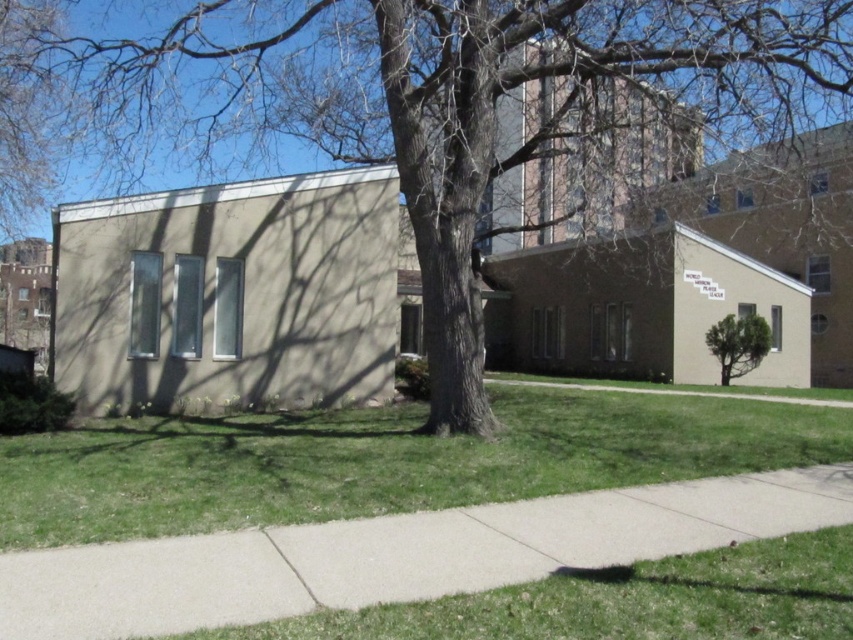
Can you confirm if brown textured tree at center is thinner than green grass at lower left?

Incorrect, brown textured tree at center's width is not less than green grass at lower left's.

In the scene shown: Between brown textured tree at center and green grass at lower left, which one appears on the right side from the viewer's perspective?

From the viewer's perspective, green grass at lower left appears more on the right side.

Which is behind, point (701, 38) or point (622, 477)?

The point (701, 38) is behind.

Where is `brown textured tree at center`? This screenshot has height=640, width=853. brown textured tree at center is located at coordinates (428, 99).

Does point (703, 474) come in front of point (300, 563)?

That is False.

This screenshot has width=853, height=640. Describe the element at coordinates (381, 461) in the screenshot. I see `green grass at lower left` at that location.

The height and width of the screenshot is (640, 853). Identify the location of green grass at lower left. (381, 461).

Is brown textured tree at center bigger than green leafy tree at lower right?

Indeed, brown textured tree at center has a larger size compared to green leafy tree at lower right.

Measure the distance between brown textured tree at center and camera.

brown textured tree at center and camera are 9.18 meters apart from each other.

What do you see at coordinates (428, 99) in the screenshot? I see `brown textured tree at center` at bounding box center [428, 99].

At what (x,y) coordinates should I click in order to perform the action: click on brown textured tree at center. Please return your answer as a coordinate pair (x, y). Looking at the image, I should click on (428, 99).